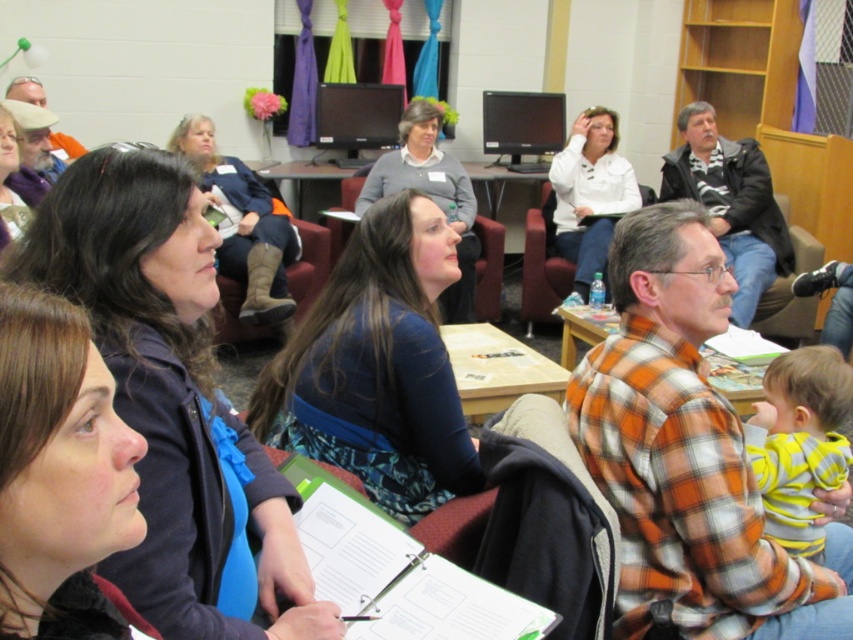
What is located at the point with coordinates [59,472] in the image?

The point at coordinates [59,472] corresponds to the brown matte hair at center.

You are sitting at the back of the meeting room and want to see the presentation clearly. Which object, the brown matte hair at center or the white matte shirt at upper center, is blocking your view more?

The brown matte hair at center is blocking your view more because it is in front of the white matte shirt at upper center.